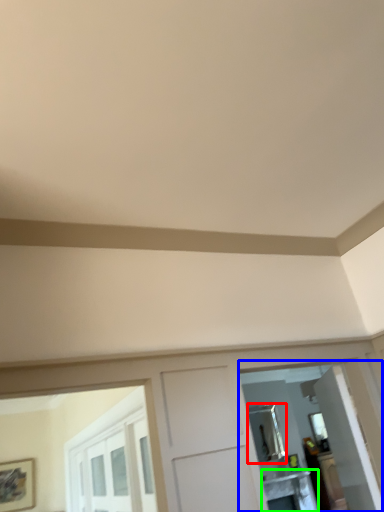
Question: Which object is the closest to the mirror (highlighted by a red box)? Choose among these: mirror (highlighted by a blue box) or table (highlighted by a green box).

Choices:
 (A) mirror
 (B) table

Answer: (B)